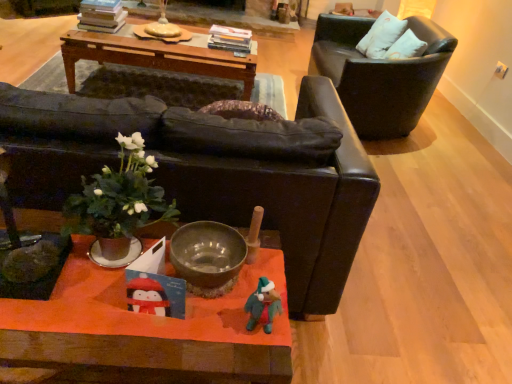
Locate an element on the screen. empty space that is ontop of wooden orange coffee table at center (from a real-world perspective) is located at coordinates (120, 295).